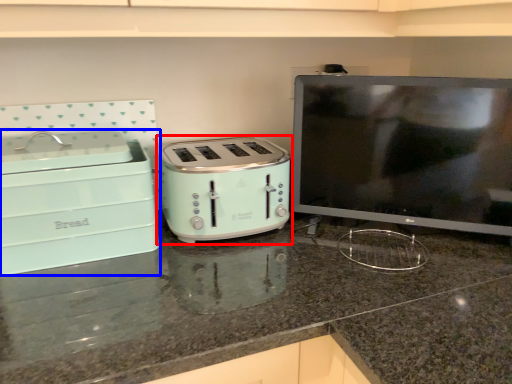
Question: Which of the following is the farthest to the observer, toaster (highlighted by a red box) or home appliance (highlighted by a blue box)?

Choices:
 (A) toaster
 (B) home appliance

Answer: (A)